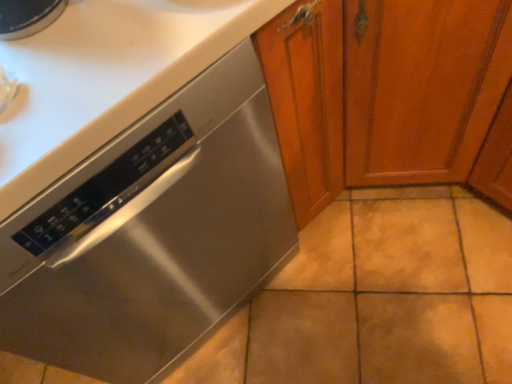
Question: In terms of size, does stained wood cabinet at center appear bigger or smaller than stainless steel dishwasher at lower left?

Choices:
 (A) small
 (B) big

Answer: (B)

Question: In terms of width, does stained wood cabinet at center look wider or thinner when compared to stainless steel dishwasher at lower left?

Choices:
 (A) thin
 (B) wide

Answer: (B)

Question: Visually, is stained wood cabinet at center positioned to the left or to the right of stainless steel dishwasher at lower left?

Choices:
 (A) right
 (B) left

Answer: (A)

Question: Is stainless steel dishwasher at lower left wider or thinner than stained wood cabinet at center?

Choices:
 (A) thin
 (B) wide

Answer: (A)

Question: In terms of size, does stainless steel dishwasher at lower left appear bigger or smaller than stained wood cabinet at center?

Choices:
 (A) small
 (B) big

Answer: (A)

Question: Relative to stained wood cabinet at center, is stainless steel dishwasher at lower left in front or behind?

Choices:
 (A) front
 (B) behind

Answer: (B)

Question: From a real-world perspective, is stainless steel dishwasher at lower left positioned above or below stained wood cabinet at center?

Choices:
 (A) above
 (B) below

Answer: (B)